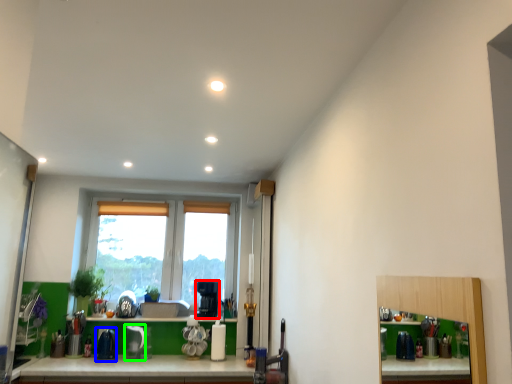
Question: Based on their relative distances, which object is nearer to coffee machine (highlighted by a red box)? Choose from appliance (highlighted by a blue box) and appliance (highlighted by a green box).

Choices:
 (A) appliance
 (B) appliance

Answer: (B)